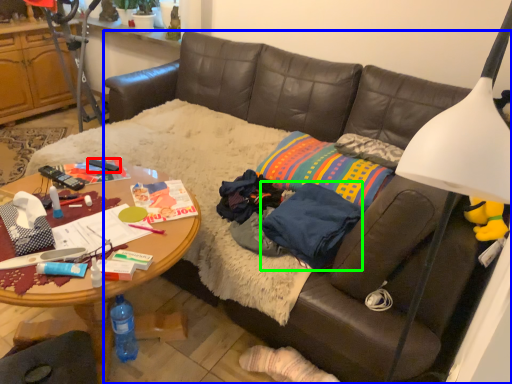
Question: Considering the real-world distances, which object is farthest from remote control (highlighted by a red box)? studio couch (highlighted by a blue box) or clothing (highlighted by a green box)?

Choices:
 (A) studio couch
 (B) clothing

Answer: (A)